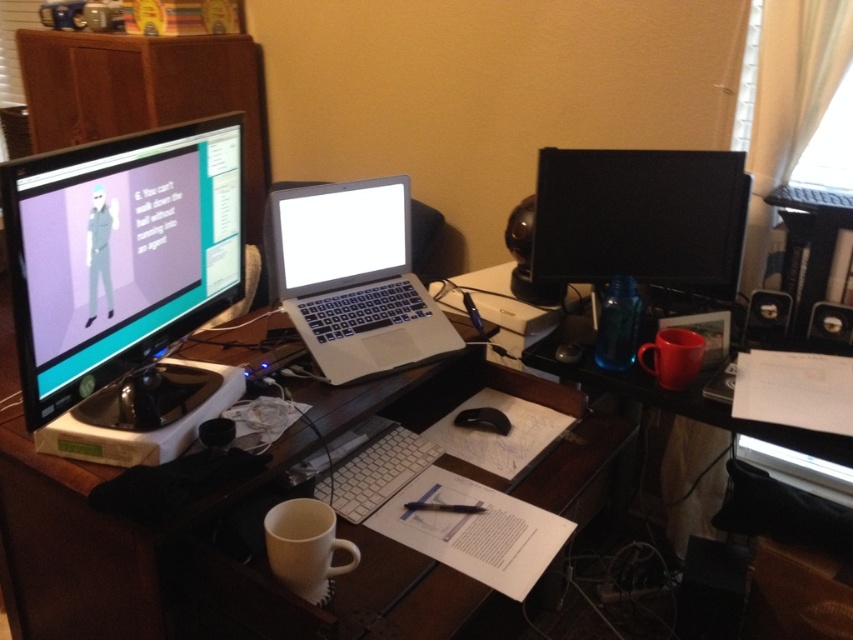
Can you confirm if silver metallic laptop at center is shorter than white glossy laptop at center?

No, silver metallic laptop at center is not shorter than white glossy laptop at center.

Does silver metallic laptop at center have a smaller size compared to white glossy laptop at center?

Incorrect, silver metallic laptop at center is not smaller in size than white glossy laptop at center.

Between point (364, 221) and point (398, 253), which one is positioned in front?

Point (364, 221)

Locate an element on the screen. This screenshot has width=853, height=640. silver metallic laptop at center is located at coordinates (354, 276).

Which is above, matte black monitor at left or white glossy laptop at center?

white glossy laptop at center is higher up.

Find the location of `matte black monitor at left`. matte black monitor at left is located at coordinates (119, 252).

Measure the distance between matte black monitor at left and camera.

32.38 inches

You are a GUI agent. You are given a task and a screenshot of the screen. Output one action in this format:
    pyautogui.click(x=<x>, y=<y>)
    Task: Click on the matte black monitor at left
    Image resolution: width=853 pixels, height=640 pixels.
    Given the screenshot: What is the action you would take?
    pyautogui.click(x=119, y=252)

Is white glossy desk at center positioned before black glossy monitor at upper right?

Yes.

Between white glossy desk at center and black glossy monitor at upper right, which one appears on the left side from the viewer's perspective?

white glossy desk at center is more to the left.

Where is `white glossy desk at center`? The height and width of the screenshot is (640, 853). white glossy desk at center is located at coordinates (194, 566).